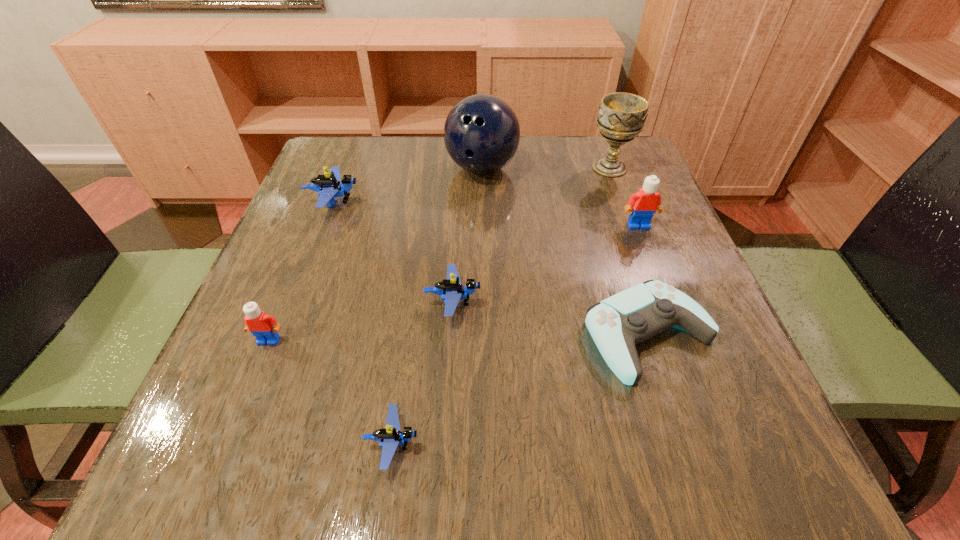
In order to click on blank area in the image that satisfies the following two spatial constraints: 1. on the front-facing side of the biggest blue Lego; 2. on the back side of the control in this screenshot , I will do `click(283, 335)`.

Locate an element on the screen. The width and height of the screenshot is (960, 540). vacant point that satisfies the following two spatial constraints: 1. on the front-facing side of the leftmost blue Lego; 2. on the face of the smaller white Lego is located at coordinates pyautogui.click(x=281, y=340).

The width and height of the screenshot is (960, 540). I want to click on vacant space that satisfies the following two spatial constraints: 1. on the front-facing side of the control; 2. on the left side of the second smallest blue Lego, so click(x=450, y=335).